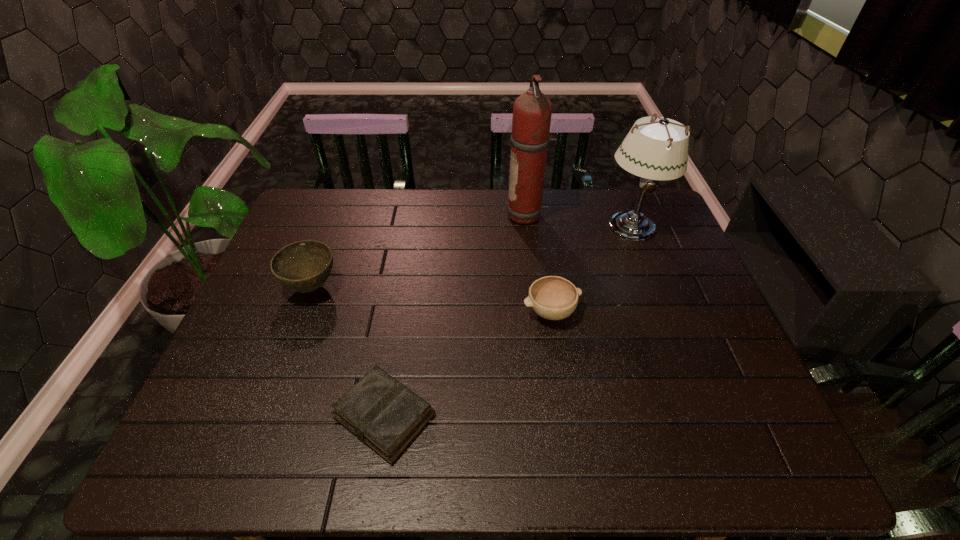
The height and width of the screenshot is (540, 960). Find the location of `vacant area located 0.330m on the side of the tallest object with the label and nozzle`. vacant area located 0.330m on the side of the tallest object with the label and nozzle is located at coordinates (406, 216).

This screenshot has height=540, width=960. Identify the location of vacant area situated on the side of the tallest object with the label and nozzle. (388, 216).

The height and width of the screenshot is (540, 960). In order to click on free space located 0.310m on the lampshade of the lampshade in this screenshot , I will do `click(670, 327)`.

At what (x,y) coordinates should I click in order to perform the action: click on vacant space located 0.300m on the right of the taller bowl. Please return your answer as a coordinate pair (x, y). The height and width of the screenshot is (540, 960). Looking at the image, I should click on (448, 287).

This screenshot has width=960, height=540. I want to click on free region located on the front of the shorter bowl, so click(565, 411).

The height and width of the screenshot is (540, 960). I want to click on vacant space located on the right of the book, so click(x=547, y=416).

You are a GUI agent. You are given a task and a screenshot of the screen. Output one action in this format:
    pyautogui.click(x=<x>, y=<y>)
    Task: Click on the fire extinguisher positioned at the far edge
    
    Given the screenshot: What is the action you would take?
    pyautogui.click(x=532, y=110)

Locate an element on the screen. The height and width of the screenshot is (540, 960). lampshade at the far edge is located at coordinates (658, 150).

At what (x,y) coordinates should I click in order to perform the action: click on object that is at the near edge. Please return your answer as a coordinate pair (x, y). This screenshot has height=540, width=960. Looking at the image, I should click on (384, 414).

Identify the location of object at the left edge. (303, 266).